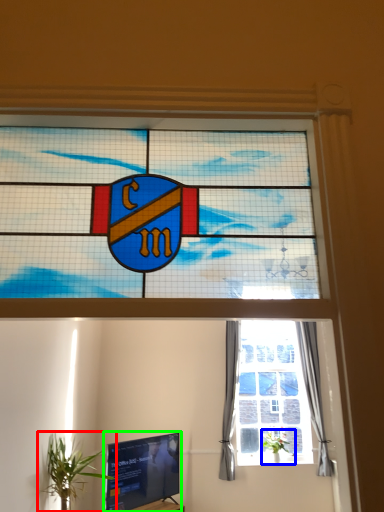
Question: Which is nearer to the houseplant (highlighted by a red box)? houseplant (highlighted by a blue box) or television (highlighted by a green box).

Choices:
 (A) houseplant
 (B) television

Answer: (B)